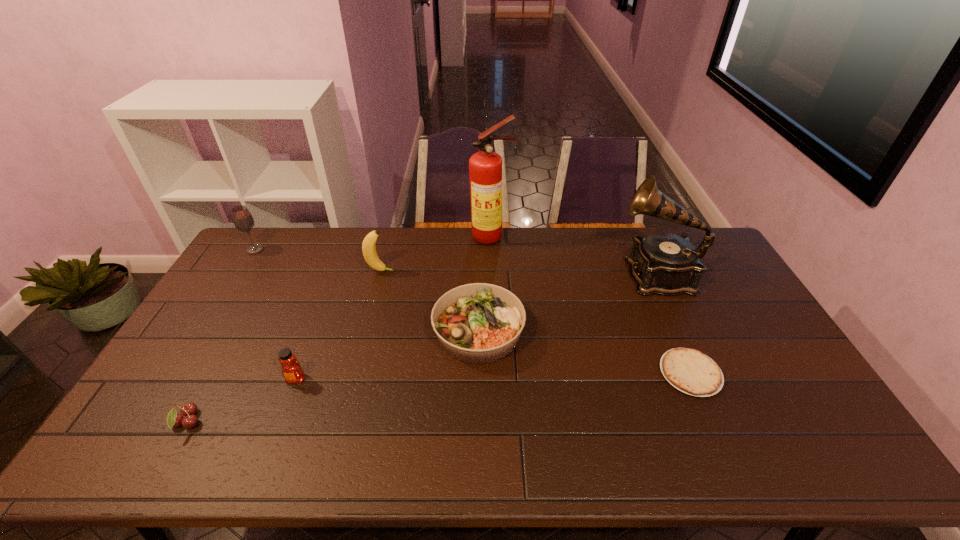
Find the location of a particular element. fire extinguisher present at the far edge is located at coordinates (485, 167).

Where is `phonograph record present at the far edge`? phonograph record present at the far edge is located at coordinates (662, 263).

The height and width of the screenshot is (540, 960). Find the location of `glass drink container located in the far edge section of the desktop`. glass drink container located in the far edge section of the desktop is located at coordinates (242, 218).

Identify the location of object that is at the near edge. Image resolution: width=960 pixels, height=540 pixels. (188, 410).

I want to click on glass drink container present at the left edge, so click(x=242, y=218).

Identify the location of cherry situated at the left edge. (188, 410).

Locate an element on the screen. The height and width of the screenshot is (540, 960). object that is positioned at the right edge is located at coordinates (662, 263).

This screenshot has height=540, width=960. Identify the location of object present at the far left corner. (242, 218).

You are a GUI agent. You are given a task and a screenshot of the screen. Output one action in this format:
    pyautogui.click(x=<x>, y=<y>)
    Task: Click on the object present at the near left corner
    This screenshot has width=960, height=540.
    Given the screenshot: What is the action you would take?
    pyautogui.click(x=188, y=410)

Locate an element on the screen. object that is positioned at the far right corner is located at coordinates (662, 263).